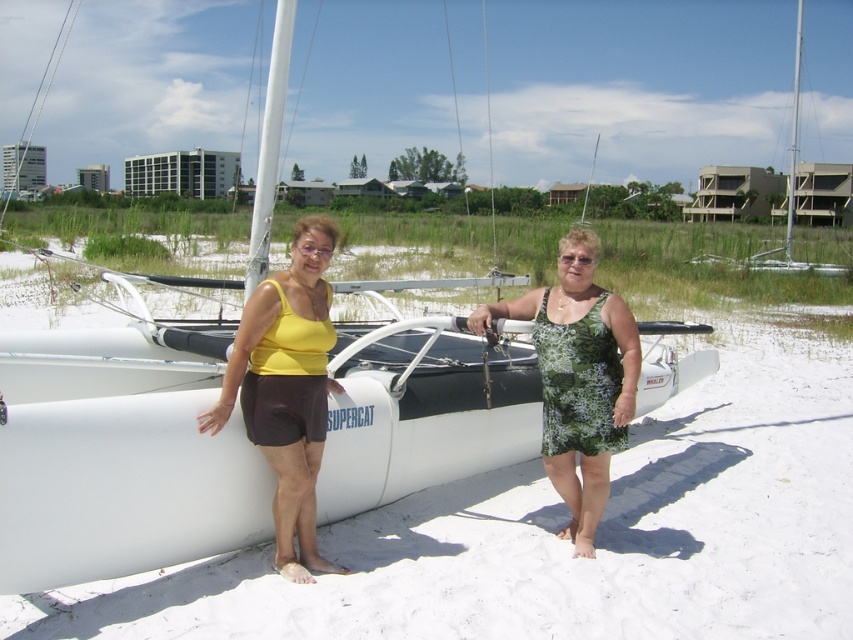
Is white matte catamaran at center further to camera compared to white plastic sailboat at upper right?

That is False.

Does white matte catamaran at center lie in front of white plastic sailboat at upper right?

Yes, it is.

This screenshot has width=853, height=640. In order to click on white matte catamaran at center in this screenshot , I will do `click(566, 541)`.

Consider the image. Is green floral dress at center to the left of white plastic sailboat at upper right from the viewer's perspective?

Indeed, green floral dress at center is positioned on the left side of white plastic sailboat at upper right.

Is green floral dress at center closer to camera compared to white plastic sailboat at upper right?

Yes, it is in front of white plastic sailboat at upper right.

Between point (538, 308) and point (734, 198), which one is positioned behind?

The point (734, 198) is more distant.

Identify the location of green floral dress at center. (578, 378).

In the scene shown: Between yellow fabric tank top at center and green floral dress at center, which one appears on the left side from the viewer's perspective?

Positioned to the left is yellow fabric tank top at center.

Between yellow fabric tank top at center and green floral dress at center, which one appears on the right side from the viewer's perspective?

Positioned to the right is green floral dress at center.

What are the coordinates of `yellow fabric tank top at center` in the screenshot? It's located at (287, 388).